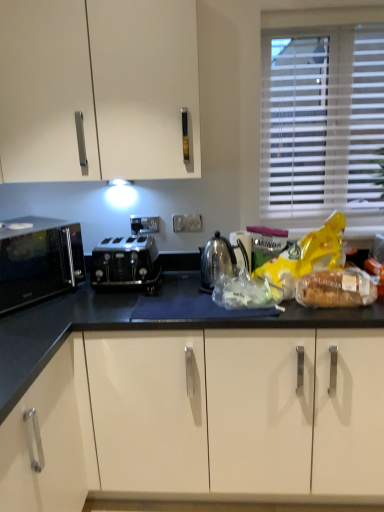
The image size is (384, 512). What are the coordinates of `free spot above satin silver toaster at center (from a real-world perspective)` in the screenshot? It's located at (123, 242).